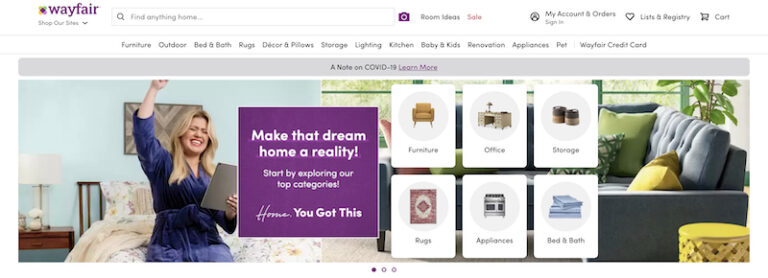
The width and height of the screenshot is (768, 278). I want to click on decor and pillows link, so [x=280, y=42].